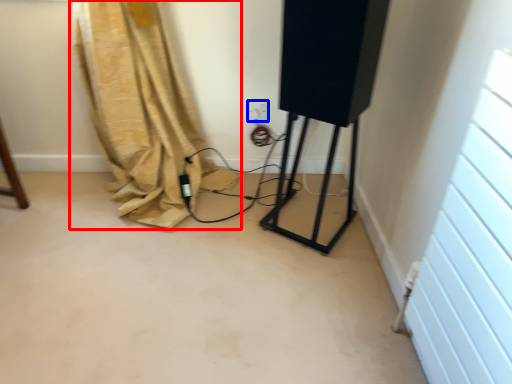
Question: Which of the following is the closest to the observer, curtain (highlighted by a red box) or electric outlet (highlighted by a blue box)?

Choices:
 (A) curtain
 (B) electric outlet

Answer: (A)